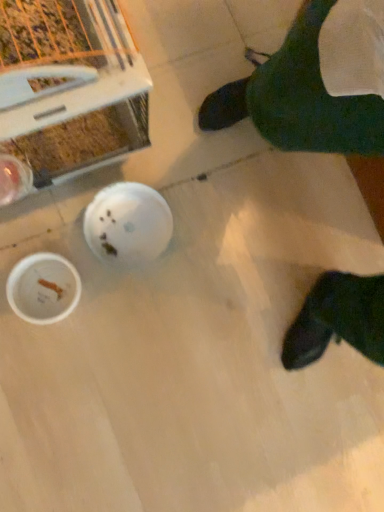
Measure the distance between point (49, 101) and camera.

The distance of point (49, 101) from camera is 65.30 centimeters.

You are a GUI agent. You are given a task and a screenshot of the screen. Output one action in this format:
    pyautogui.click(x=<x>, y=<y>)
    Task: Click on the white plastic cage at upper left
    The height and width of the screenshot is (512, 384).
    Given the screenshot: What is the action you would take?
    click(67, 92)

This screenshot has height=512, width=384. Describe the element at coordinates (67, 92) in the screenshot. I see `white plastic cage at upper left` at that location.

The image size is (384, 512). I want to click on white plastic cage at upper left, so click(x=67, y=92).